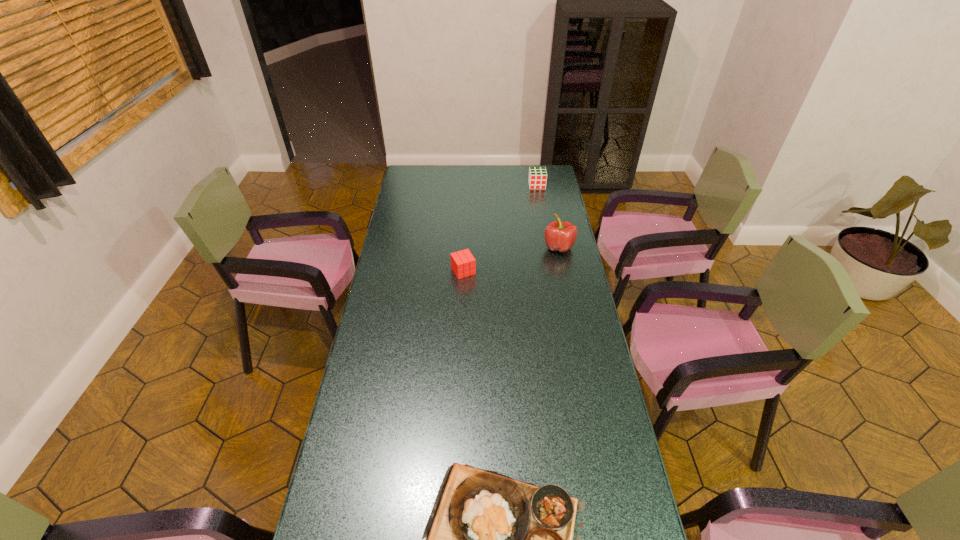
This screenshot has width=960, height=540. Find the location of `free space between the farther cube and the tallest object`. free space between the farther cube and the tallest object is located at coordinates (548, 216).

Find the location of `unoccupied area between the nearer cube and the farthest object`. unoccupied area between the nearer cube and the farthest object is located at coordinates (500, 228).

Locate an element on the screen. object that stands as the closest to the right cube is located at coordinates (560, 236).

Point out which object is positioned as the third nearest to the platter. Please provide its 2D coordinates. Your answer should be formatted as a tuple, i.e. [(x, y)], where the tuple contains the x and y coordinates of a point satisfying the conditions above.

[(537, 179)]

Find the location of a particular element. This screenshot has height=540, width=960. free space that satisfies the following two spatial constraints: 1. on the red face of the right cube; 2. on the left side of the pepper is located at coordinates click(548, 247).

At what (x,y) coordinates should I click in order to perform the action: click on free location that satisfies the following two spatial constraints: 1. on the red face of the second farthest object; 2. on the right side of the farther cube. Please return your answer as a coordinate pair (x, y). The height and width of the screenshot is (540, 960). Looking at the image, I should click on (548, 247).